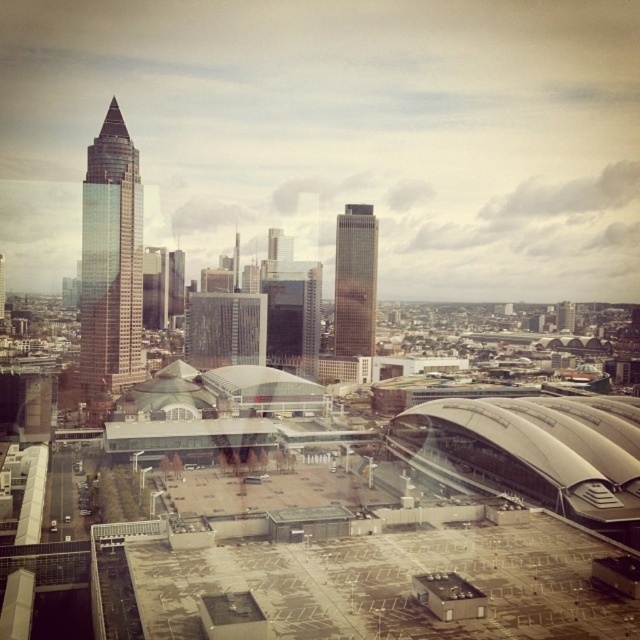
Can you confirm if shiny glass skyscraper at left is positioned below gold reflective skyscraper at center?

No.

Is shiny glass skyscraper at left closer to the viewer compared to gold reflective skyscraper at center?

Yes, shiny glass skyscraper at left is in front of gold reflective skyscraper at center.

Is point (116, 144) positioned behind point (356, 220)?

No, (116, 144) is in front of (356, 220).

Where is `shiny glass skyscraper at left`? The height and width of the screenshot is (640, 640). shiny glass skyscraper at left is located at coordinates (109, 260).